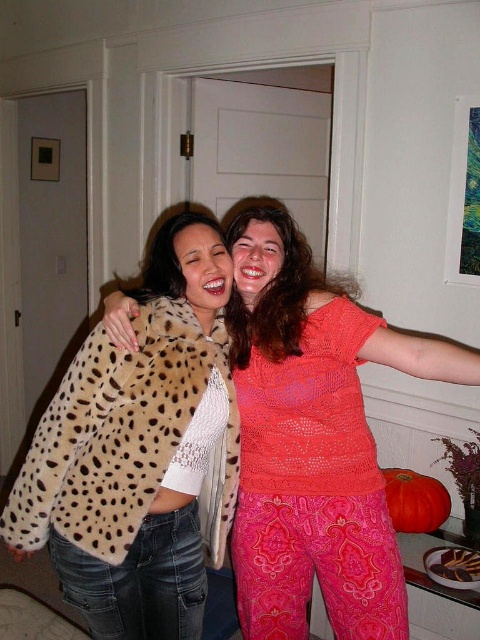
Does point (107, 528) come in front of point (287, 566)?

Yes, it is in front of point (287, 566).

Can you confirm if spotted fur coat at center is positioned below cheetah print coat at center?

Incorrect, spotted fur coat at center is not positioned below cheetah print coat at center.

Describe the element at coordinates (139, 451) in the screenshot. The image size is (480, 640). I see `spotted fur coat at center` at that location.

Where is `spotted fur coat at center`? Image resolution: width=480 pixels, height=640 pixels. spotted fur coat at center is located at coordinates (139, 451).